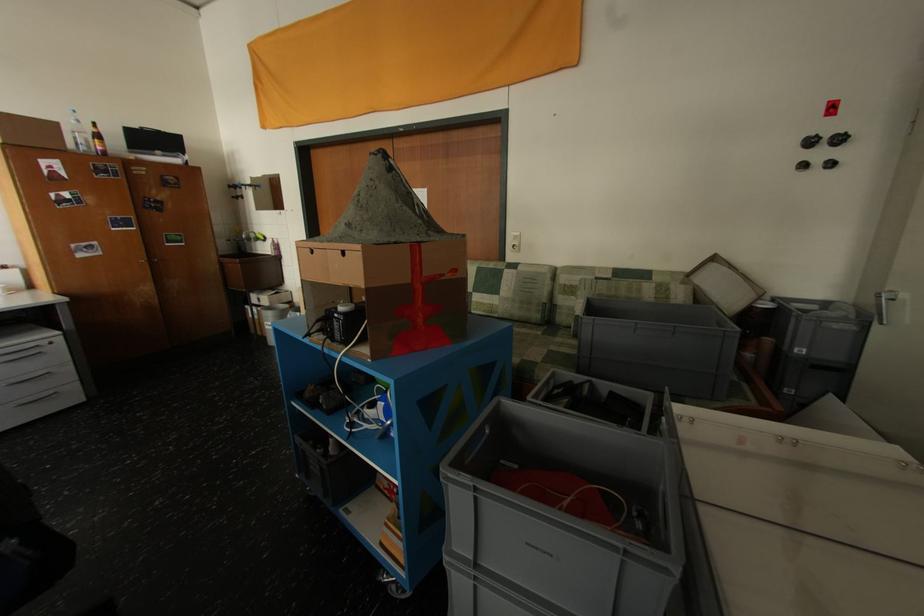
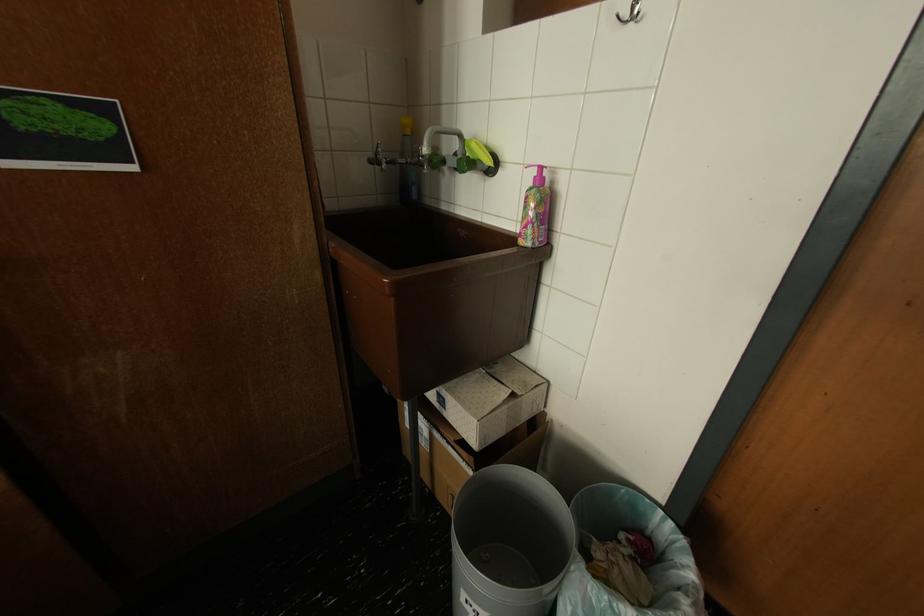
Find the pixel in the second image that matches point (262, 233) in the first image.

(468, 138)